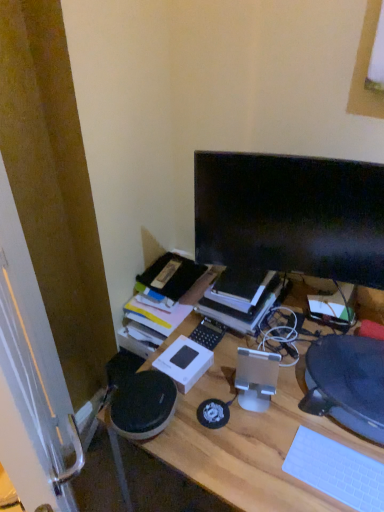
The height and width of the screenshot is (512, 384). Describe the element at coordinates (347, 383) in the screenshot. I see `black textured computer chair at right` at that location.

What do you see at coordinates (241, 309) in the screenshot? The width and height of the screenshot is (384, 512). I see `hardcover book at center` at bounding box center [241, 309].

Locate an element on the screen. This screenshot has width=384, height=512. wooden desk at center is located at coordinates (250, 440).

Considering the points (205, 304) and (308, 355), which point is behind, point (205, 304) or point (308, 355)?

Point (205, 304)

From the image's perspective, which object appears higher, hardcover book at center or black textured computer chair at right?

hardcover book at center.

Is hardcover book at center bigger or smaller than black textured computer chair at right?

Considering their sizes, hardcover book at center takes up more space than black textured computer chair at right.

From a real-world perspective, is black textured computer chair at right on hardcover book at center?

Incorrect, from a real-world perspective, black textured computer chair at right is lower than hardcover book at center.

Is black textured computer chair at right inside the boundaries of hardcover book at center, or outside?

black textured computer chair at right is located beyond the bounds of hardcover book at center.

From the image's perspective, is black textured computer chair at right located beneath hardcover book at center?

Correct, black textured computer chair at right appears lower than hardcover book at center in the image.

In the scene shown: Between black textured computer chair at right and hardcover book at center, which one appears on the right side from the viewer's perspective?

black textured computer chair at right.

From a real-world perspective, which is physically above, white matte keyboard at lower right or hardcover book at center?

In real-world perspective, hardcover book at center is above.

Which of these two, white matte keyboard at lower right or hardcover book at center, is wider?

Wider between the two is hardcover book at center.

Identify the location of book above the white matte keyboard at lower right (from the image's perspective). This screenshot has width=384, height=512. (241, 309).

Does point (363, 283) appear closer or farther from the camera than point (379, 489)?

Clearly, point (363, 283) is more distant from the camera than point (379, 489).

How much distance is there between black glossy monitor at upper right and white matte keyboard at lower right?

black glossy monitor at upper right and white matte keyboard at lower right are 22.24 inches apart.

How many degrees apart are the facing directions of black glossy monitor at upper right and white matte keyboard at lower right?

They differ by 18.8 degrees in their facing directions.

In the image, there is a white matte keyboard at lower right. Identify the location of computer monitor above it (from the image's perspective). (291, 215).

This screenshot has width=384, height=512. Find the location of `computer keyboard that is on the left side of black textured computer chair at right`. computer keyboard that is on the left side of black textured computer chair at right is located at coordinates (336, 471).

From the image's perspective, between white matte keyboard at lower right and black textured computer chair at right, which one is located above?

From the image's view, black textured computer chair at right is above.

Is white matte keyboard at lower right positioned behind black textured computer chair at right?

That is False.

Is black textured computer chair at right looking in the opposite direction of black glossy monitor at upper right?

No, black glossy monitor at upper right is not at the back of black textured computer chair at right.

How distant is black textured computer chair at right from black glossy monitor at upper right?

black textured computer chair at right and black glossy monitor at upper right are 13.95 inches apart from each other.

Does black textured computer chair at right touch black glossy monitor at upper right?

No.

Is black textured computer chair at right not within black glossy monitor at upper right?

Indeed, black textured computer chair at right is completely outside black glossy monitor at upper right.

Is wooden desk at center next to hardcover book at center?

There is a gap between wooden desk at center and hardcover book at center.

From the image's perspective, is wooden desk at center located above or below hardcover book at center?

wooden desk at center is situated lower than hardcover book at center in the image.

Which object is thinner, wooden desk at center or hardcover book at center?

hardcover book at center is thinner.

Does point (208, 463) come closer to viewer compared to point (238, 329)?

Yes.

At what (x,y) coordinates should I click in order to perform the action: click on book to the left of black textured computer chair at right. Please return your answer as a coordinate pair (x, y). Looking at the image, I should click on tap(241, 309).

This screenshot has width=384, height=512. Identify the location of book lying above the black textured computer chair at right (from the image's perspective). (241, 309).

From the picture: Looking at the image, which one is located closer to wooden desk at center, white matte keyboard at lower right or hardcover book at center?

white matte keyboard at lower right is closer to wooden desk at center.

Which object lies further to the anchor point black textured computer chair at right, black glossy monitor at upper right or hardcover book at center?

Based on the image, black glossy monitor at upper right appears to be further to black textured computer chair at right.

Based on their spatial positions, is wooden desk at center or black glossy monitor at upper right further from hardcover book at center?

The object further to hardcover book at center is black glossy monitor at upper right.

Considering their positions, is black glossy monitor at upper right positioned closer to hardcover book at center than black textured computer chair at right?

black glossy monitor at upper right is positioned closer to the anchor hardcover book at center.

From the image, which object appears to be farther from hardcover book at center, black textured computer chair at right or white matte keyboard at lower right?

white matte keyboard at lower right is further to hardcover book at center.

Based on their spatial positions, is black glossy monitor at upper right or wooden desk at center further from white matte keyboard at lower right?

Based on the image, black glossy monitor at upper right appears to be further to white matte keyboard at lower right.

Which object lies further to the anchor point black textured computer chair at right, white matte keyboard at lower right or black glossy monitor at upper right?

Among the two, black glossy monitor at upper right is located further to black textured computer chair at right.

Considering their positions, is white matte keyboard at lower right positioned closer to black glossy monitor at upper right than wooden desk at center?

The object closer to black glossy monitor at upper right is wooden desk at center.

You are a GUI agent. You are given a task and a screenshot of the screen. Output one action in this format:
    pyautogui.click(x=<x>, y=<y>)
    Task: Click on the computer chair between hardcover book at center and wooden desk at center from top to bottom
    The width and height of the screenshot is (384, 512).
    Given the screenshot: What is the action you would take?
    tap(347, 383)

You are a GUI agent. You are given a task and a screenshot of the screen. Output one action in this format:
    pyautogui.click(x=<x>, y=<y>)
    Task: Click on the computer keyboard between black glossy monitor at upper right and wooden desk at center in the vertical direction
    This screenshot has width=384, height=512.
    Given the screenshot: What is the action you would take?
    pyautogui.click(x=336, y=471)

The height and width of the screenshot is (512, 384). Find the location of `computer keyboard between black textured computer chair at right and wooden desk at center from top to bottom`. computer keyboard between black textured computer chair at right and wooden desk at center from top to bottom is located at coordinates (336, 471).

Find the location of a particular element. book between black glossy monitor at upper right and white matte keyboard at lower right in the up-down direction is located at coordinates (241, 309).